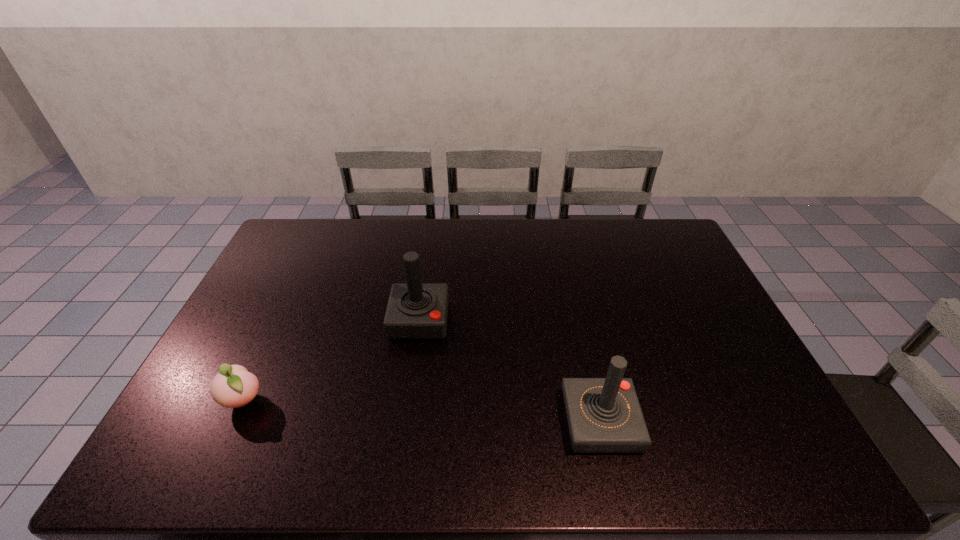
Find the location of a particular element. This screenshot has width=960, height=540. vacant space located on the back of the peach is located at coordinates (276, 330).

This screenshot has height=540, width=960. Find the location of `object located in the near edge section of the desktop`. object located in the near edge section of the desktop is located at coordinates (604, 415).

The image size is (960, 540). I want to click on object that is at the left edge, so click(233, 386).

Identify the location of blank space at the far edge. Image resolution: width=960 pixels, height=540 pixels. (482, 234).

You are a GUI agent. You are given a task and a screenshot of the screen. Output one action in this format:
    pyautogui.click(x=<x>, y=<y>)
    Task: Click on the vacant region at the near edge of the desktop
    
    Given the screenshot: What is the action you would take?
    pyautogui.click(x=428, y=454)

Where is `vacant point at the left edge`? This screenshot has width=960, height=540. vacant point at the left edge is located at coordinates (283, 302).

Find the location of a particular element. Image resolution: width=960 pixels, height=540 pixels. free region at the right edge of the desktop is located at coordinates (692, 261).

At what (x,y) coordinates should I click in order to perform the action: click on free spot at the near left corner of the desktop. Please return your answer as a coordinate pair (x, y). Looking at the image, I should click on (190, 455).

This screenshot has height=540, width=960. In the image, there is a desktop. In order to click on blank space at the far right corner in this screenshot , I will do `click(640, 228)`.

Find the location of a particular element. empty location between the farthest object and the nearer joystick is located at coordinates (510, 372).